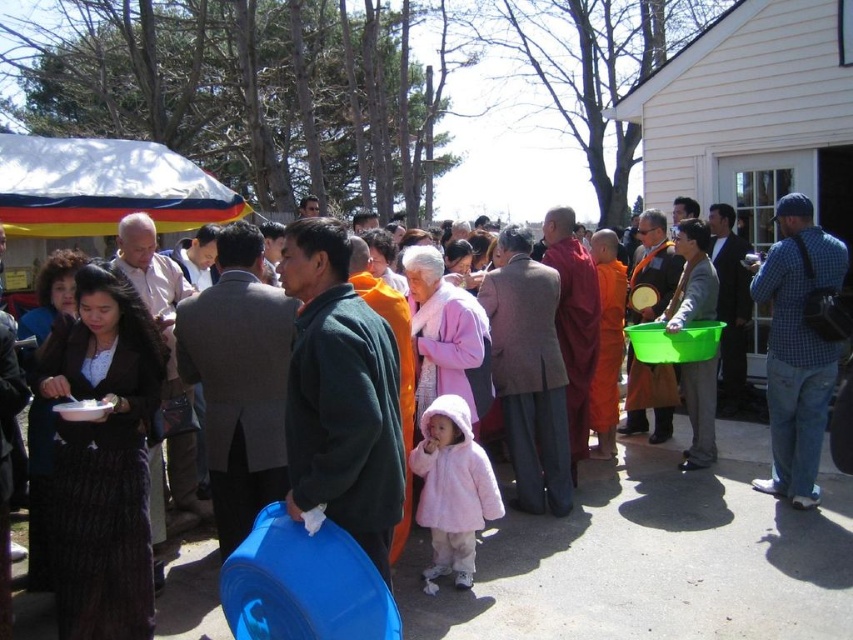
Based on the photo, which is more to the right, velvet dark brown robe at left or maroon silk robe at center?

maroon silk robe at center

Which is behind, point (105, 554) or point (595, 307)?

Positioned behind is point (595, 307).

Find the location of `velvet dark brown robe at left`. velvet dark brown robe at left is located at coordinates [x=102, y=481].

In the scene shown: Does velvet dark brown robe at left appear over green plastic bucket at center?

No, velvet dark brown robe at left is not above green plastic bucket at center.

Between velvet dark brown robe at left and green plastic bucket at center, which one appears on the right side from the viewer's perspective?

From the viewer's perspective, green plastic bucket at center appears more on the right side.

Between point (138, 509) and point (674, 320), which one is positioned in front?

Positioned in front is point (138, 509).

Where is `velvet dark brown robe at left`? This screenshot has width=853, height=640. velvet dark brown robe at left is located at coordinates (102, 481).

Does velvet dark brown robe at left have a lesser height compared to dark green fleece at center?

No.

Does velvet dark brown robe at left have a greater width compared to dark green fleece at center?

Yes, velvet dark brown robe at left is wider than dark green fleece at center.

At what (x,y) coordinates should I click in order to perform the action: click on velvet dark brown robe at left. Please return your answer as a coordinate pair (x, y). Looking at the image, I should click on (102, 481).